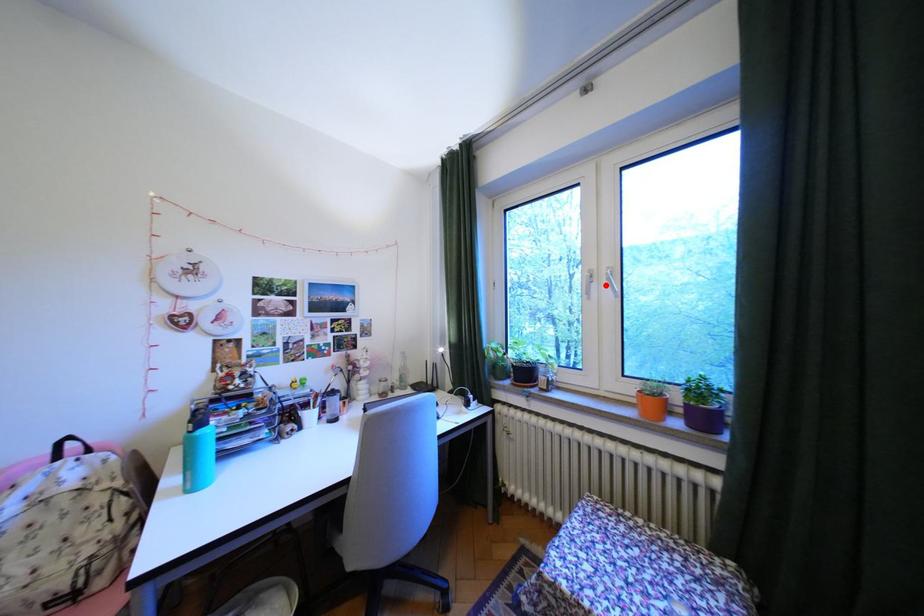
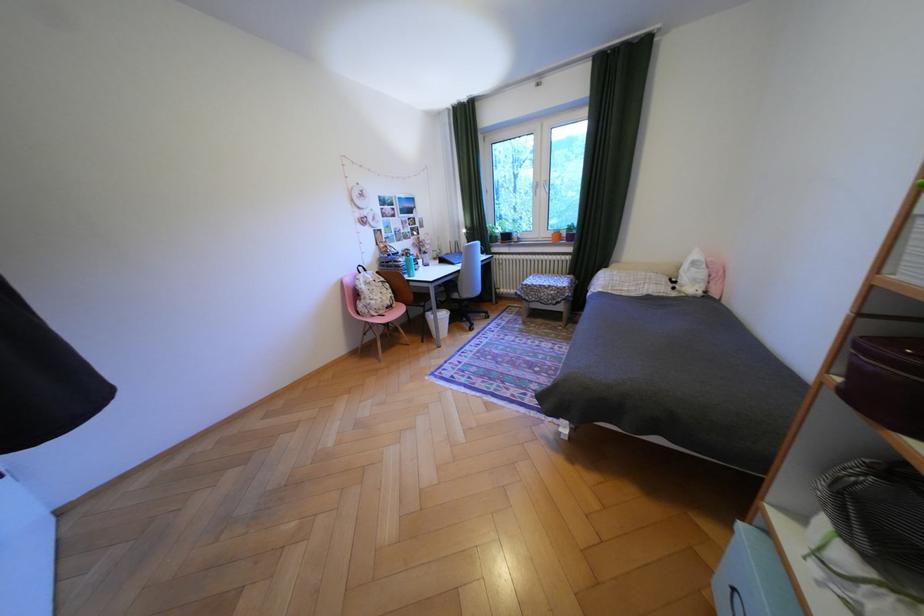
Locate, in the second image, the point that corresponds to the highlighted location in the first image.

(551, 190)